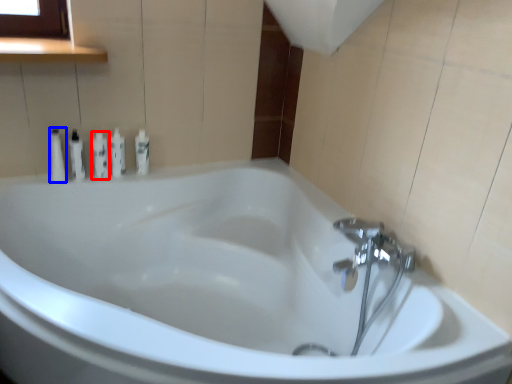
Question: Which object appears farthest to the camera in this image, toiletry (highlighted by a red box) or toiletry (highlighted by a blue box)?

Choices:
 (A) toiletry
 (B) toiletry

Answer: (A)